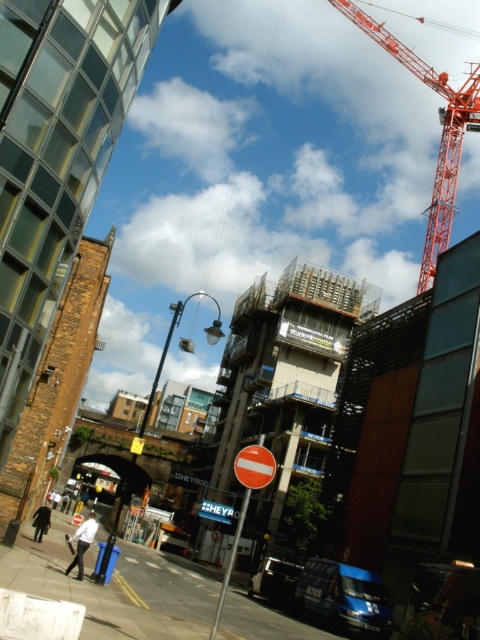
You are a city planner assessing the urban layout. You notice the orange metallic crane at upper right and the red plastic circle at center in the image. Which object takes up more visual space in the scene?

The orange metallic crane at upper right has a larger size compared to the red plastic circle at center, so it takes up more visual space in the scene.

You are a city planner assessing the urban layout. You need to install a new wireless signal booster that has a maximum effective range of 400 feet. The booster must be placed either at the orange metallic crane at upper right or the red plastic circle at center. Which location would allow the booster to cover both points without exceeding its range?

The orange metallic crane at upper right and the red plastic circle at center are 380.39 feet apart. Placing the booster at either location would allow it to cover both points since the distance between them is within the 400 feet range. However, positioning it at the midpoint between them would optimize coverage, but since the question specifies choosing one of the two points, either location works as the distance is under the maximum range.

You are a delivery person trying to navigate through the street in the urban scene. You notice a red plastic circle at center and a metallic rectangular sign at center. Which object is narrower?

The red plastic circle at center is thinner than the metallic rectangular sign at center, so the red plastic circle at center is narrower.